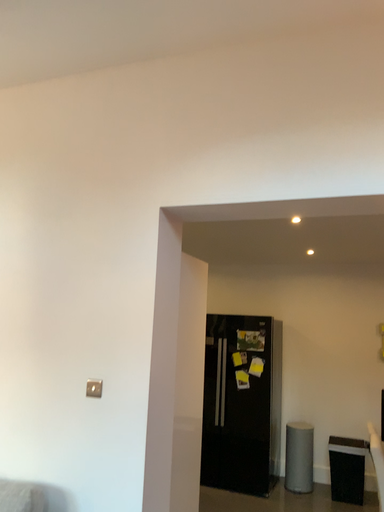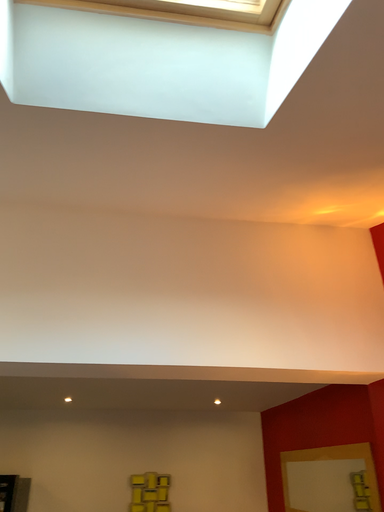
Question: Which way did the camera rotate in the video?

Choices:
 (A) rotated downward
 (B) rotated upward

Answer: (B)